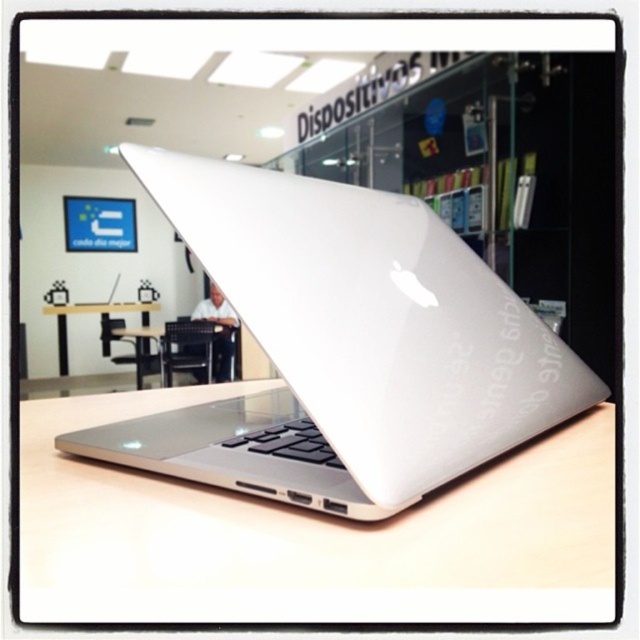
You are organizing a tech store and need to place a new display stand between the transparent plastic bookshelf at center and the white glossy table at center. According to the scene, which object should the display stand be placed to the left of?

The transparent plastic bookshelf at center is to the right of the white glossy table at center. Therefore, the display stand should be placed to the left of the transparent plastic bookshelf at center.

You are setting up a photography studio and need to place a tripod. The tripod requires a minimum height of 1.2 meters to properly frame the subject. Given the silver metallic laptop at center and the white glossy table at center, which object can the tripod be placed on to meet the height requirement?

The white glossy table at center is taller than the silver metallic laptop at center. Since the tripod requires a minimum height of 1.2 meters, the tripod should be placed on the white glossy table at center to meet the height requirement.

You are standing in front of a table with a laptop. There is a point at coordinates (346, 346). What object is located at that point?

The silver metallic laptop at center is located at point (346, 346).